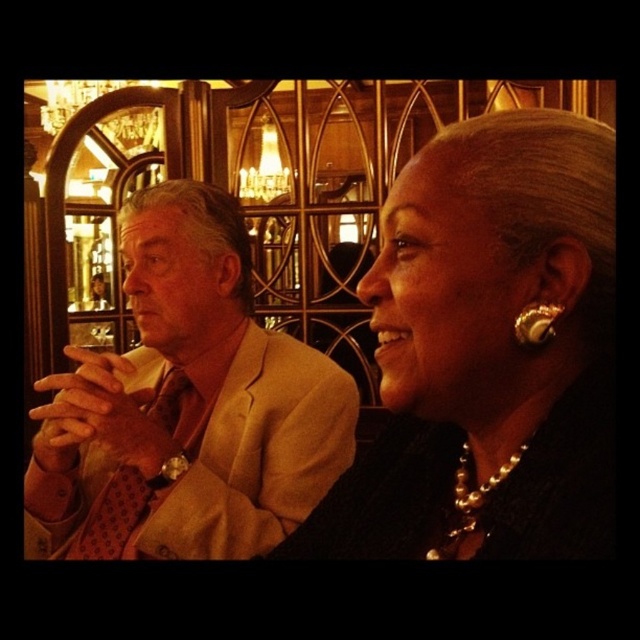
You are a photographer standing at the back of the room. You want to take a photo of the pearl necklace at center and the beige textured suit at left in the same frame. Given that your camera has a maximum focus range of 6 meters, will both objects be in focus?

The distance between the pearl necklace at center and the beige textured suit at left is 6.64 meters, which exceeds the camera maximum focus range of 6 meters. Therefore, both objects cannot be in focus simultaneously.

You are a photographer adjusting the focus on your camera. You need to ensure that both the pearl necklace at center and the beige textured suit at left are in clear focus. Given their sizes, which object should you adjust the focus towards first?

The pearl necklace at center should be focused on first because it has a larger size compared to the beige textured suit at left, making it more prominent in the composition.